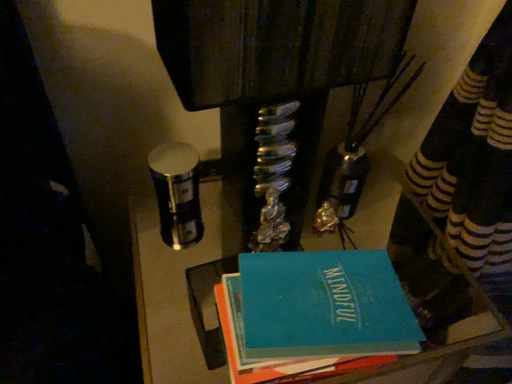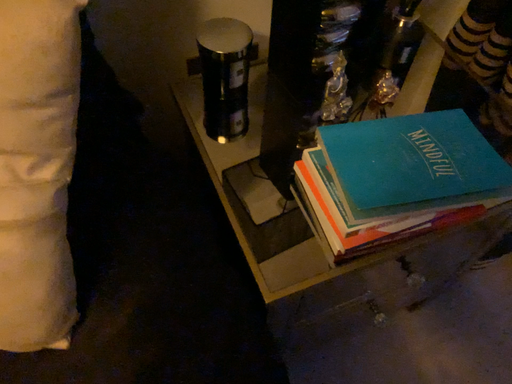
Question: Which way did the camera rotate in the video?

Choices:
 (A) rotated downward
 (B) rotated upward

Answer: (A)